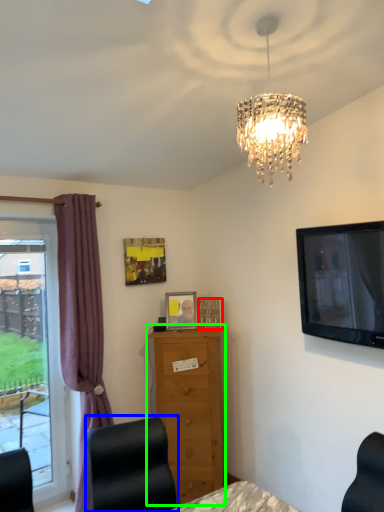
Question: Which object is the closest to the picture frame (highlighted by a red box)? Choose among these: furniture (highlighted by a blue box) or chest of drawers (highlighted by a green box).

Choices:
 (A) furniture
 (B) chest of drawers

Answer: (B)